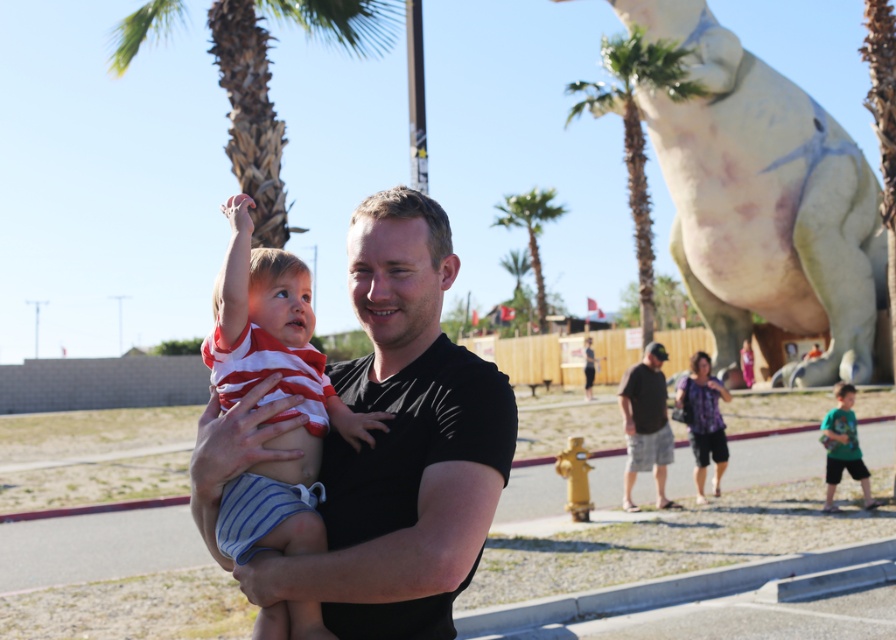
You are a photographer trying to capture the white textured dinosaur at upper right and the green leafy palm tree at upper center in the same frame. Based on their positions, which one is closer to the bottom of the photo?

The white textured dinosaur at upper right is below the green leafy palm tree at upper center, so it is closer to the bottom of the photo.

You are standing at the point closest to the camera. Which point are you at? The options are point A at coordinates point A is point (314, 461) and point B is point (662, 452). Please answer with either point A or point B.

You are at point A, which is point (314, 461), since it is in front of point B at (662, 452) from the camera perspective.